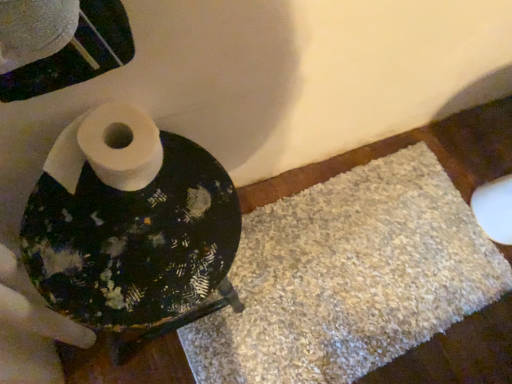
Question: In the image, is white shaggy bath mat at lower right on the left side or the right side of white matte toilet paper at center?

Choices:
 (A) right
 (B) left

Answer: (A)

Question: Is white shaggy bath mat at lower right in front of or behind white matte toilet paper at center in the image?

Choices:
 (A) front
 (B) behind

Answer: (B)

Question: In terms of width, does white shaggy bath mat at lower right look wider or thinner when compared to white matte toilet paper at center?

Choices:
 (A) wide
 (B) thin

Answer: (A)

Question: From the image's perspective, is white matte toilet paper at center above or below white shaggy bath mat at lower right?

Choices:
 (A) above
 (B) below

Answer: (A)

Question: Considering their positions, is white matte toilet paper at center located in front of or behind white shaggy bath mat at lower right?

Choices:
 (A) behind
 (B) front

Answer: (B)

Question: In terms of size, does white matte toilet paper at center appear bigger or smaller than white shaggy bath mat at lower right?

Choices:
 (A) big
 (B) small

Answer: (B)

Question: Is white matte toilet paper at center wider or thinner than white shaggy bath mat at lower right?

Choices:
 (A) wide
 (B) thin

Answer: (B)